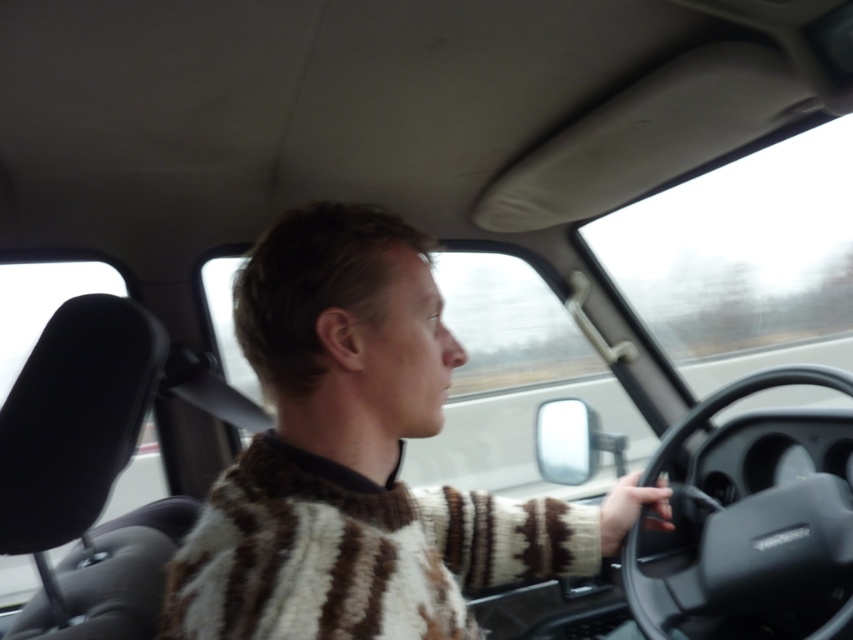
Question: Is striped wool sweater at center to the left of black matte steering wheel at center from the viewer's perspective?

Choices:
 (A) yes
 (B) no

Answer: (A)

Question: Can you confirm if striped wool sweater at center is positioned to the right of black matte steering wheel at center?

Choices:
 (A) yes
 (B) no

Answer: (B)

Question: Does striped wool sweater at center appear on the left side of black matte steering wheel at center?

Choices:
 (A) no
 (B) yes

Answer: (B)

Question: Among these points, which one is nearest to the camera?

Choices:
 (A) (749, 476)
 (B) (291, 420)

Answer: (B)

Question: Among these points, which one is farthest from the camera?

Choices:
 (A) (746, 387)
 (B) (296, 371)

Answer: (A)